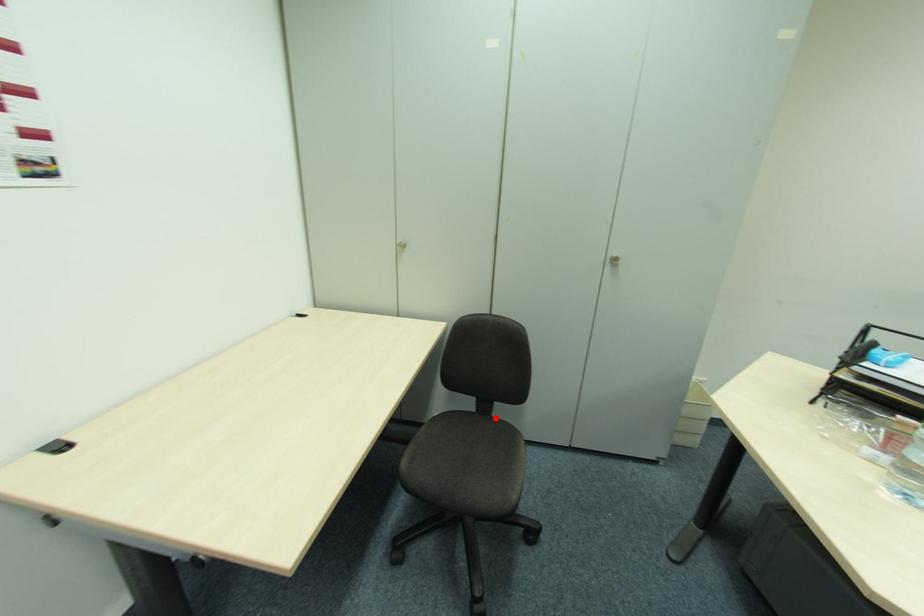
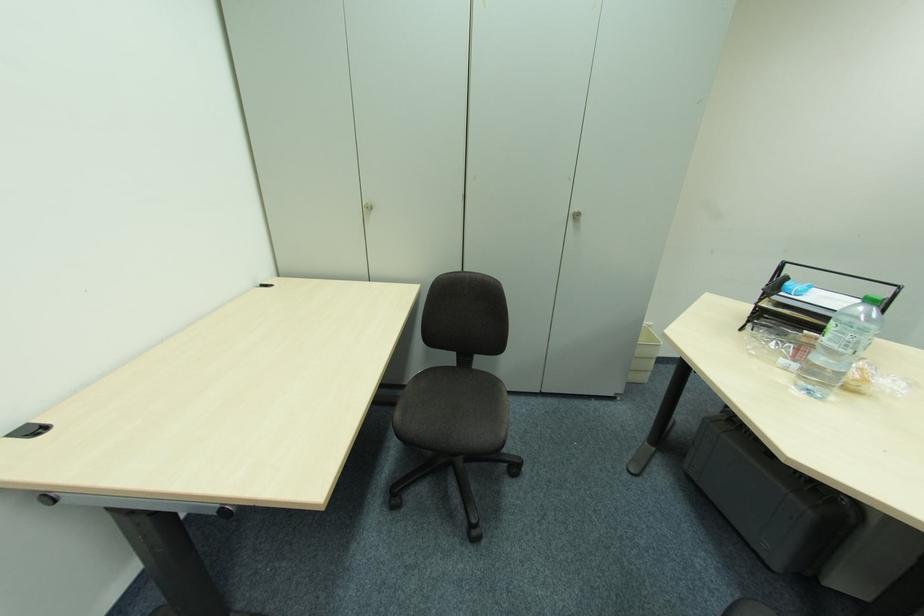
The point at the highlighted location is marked in the first image. Where is the corresponding point in the second image?

(477, 371)